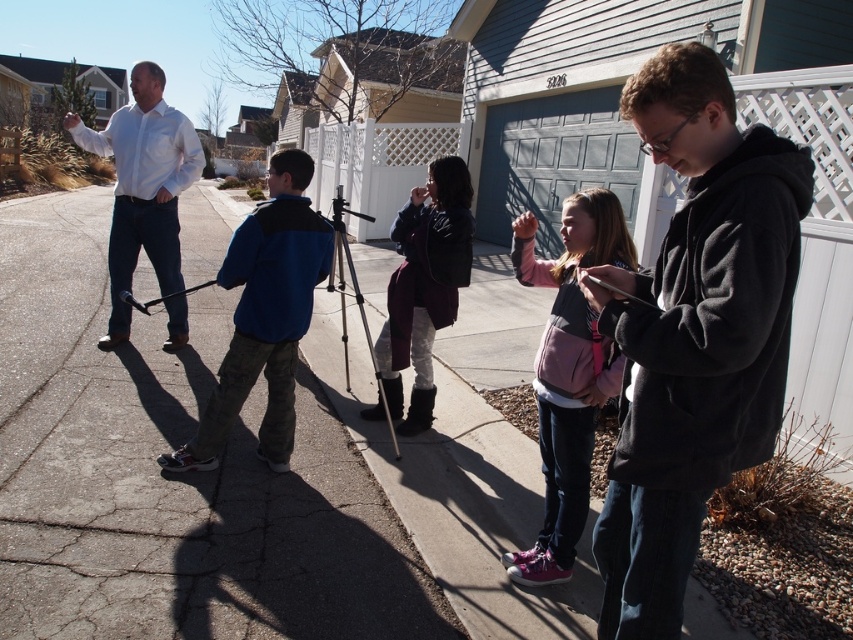
From the picture: What is the exact location of the dark gray fleece jacket at center right in the image?

The dark gray fleece jacket at center right is located at point coordinates of 0.520 on the x axis and 0.814 on the y axis.

You are standing on the concrete sidewalk at center and want to walk to the dark gray fleece jacket at center right. Which direction should you move to get closer to the jacket?

You should move forward because the concrete sidewalk at center is further away from you than the dark gray fleece jacket at center right, so moving toward it would bring you closer.